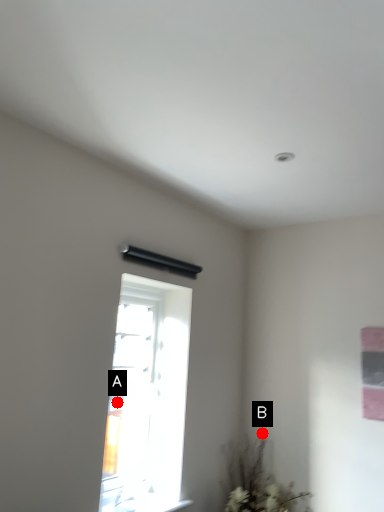
Question: Two points are circled on the image, labeled by A and B beside each circle. Which point is closer to the camera?

Choices:
 (A) A is closer
 (B) B is closer

Answer: (A)